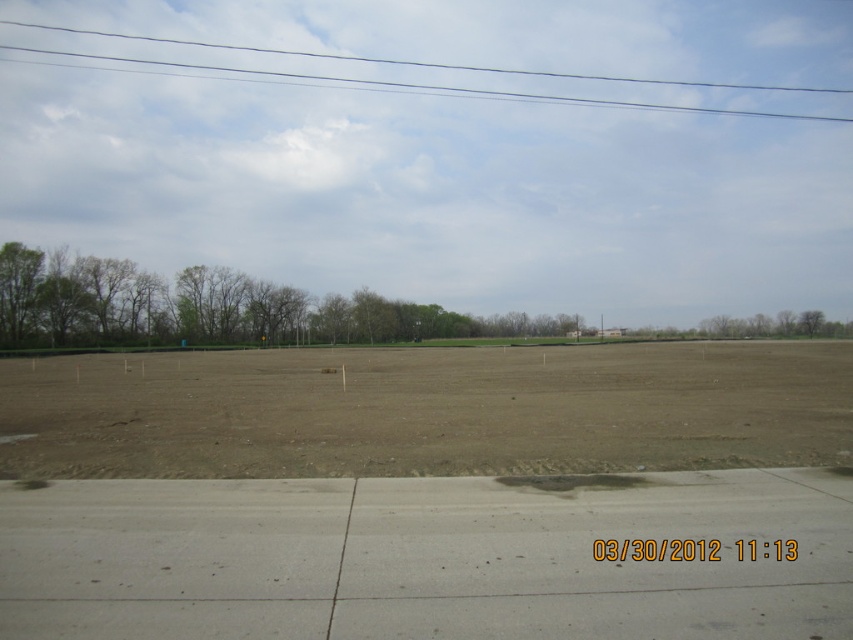
What do you see at coordinates (422, 557) in the screenshot?
I see `gray concrete pavement at bottom` at bounding box center [422, 557].

Consider the image. Is gray concrete pavement at bottom smaller than brown/dry soil at center?

Yes, gray concrete pavement at bottom is smaller than brown/dry soil at center.

The height and width of the screenshot is (640, 853). Identify the location of gray concrete pavement at bottom. (422, 557).

Measure the distance between brown/dry soil at center and clear wire at upper center.

A distance of 133.33 meters exists between brown/dry soil at center and clear wire at upper center.

Can you confirm if brown/dry soil at center is thinner than clear wire at upper center?

Correct, brown/dry soil at center's width is less than clear wire at upper center's.

Is point (848, 456) farther from viewer compared to point (399, 83)?

No.

What are the coordinates of `brown/dry soil at center` in the screenshot? It's located at (428, 410).

Does gray concrete pavement at bottom have a lesser width compared to clear wire at upper center?

Yes.

Which is below, gray concrete pavement at bottom or clear wire at upper center?

gray concrete pavement at bottom is lower down.

Who is more forward, (67, 508) or (215, 45)?

Point (67, 508) is more forward.

Where is `gray concrete pavement at bottom`? Image resolution: width=853 pixels, height=640 pixels. gray concrete pavement at bottom is located at coordinates (422, 557).